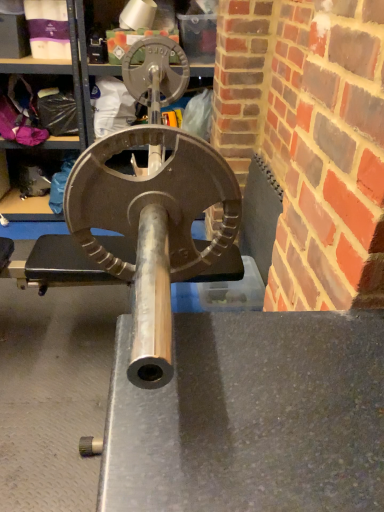
Identify the location of matte purple fabric at upper left. (48, 28).

What do you see at coordinates (48, 28) in the screenshot?
I see `matte purple fabric at upper left` at bounding box center [48, 28].

Find the location of a particular element. The width and height of the screenshot is (384, 512). matte purple fabric at upper left is located at coordinates (48, 28).